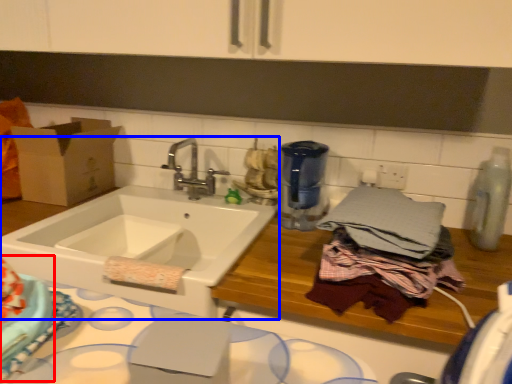
Question: Which object is closer to the camera taking this photo, cake (highlighted by a red box) or sink (highlighted by a blue box)?

Choices:
 (A) cake
 (B) sink

Answer: (A)